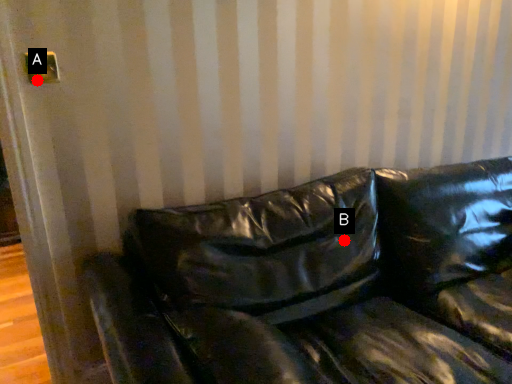
Question: Two points are circled on the image, labeled by A and B beside each circle. Which of the following is the closest to the observer?

Choices:
 (A) A is closer
 (B) B is closer

Answer: (A)